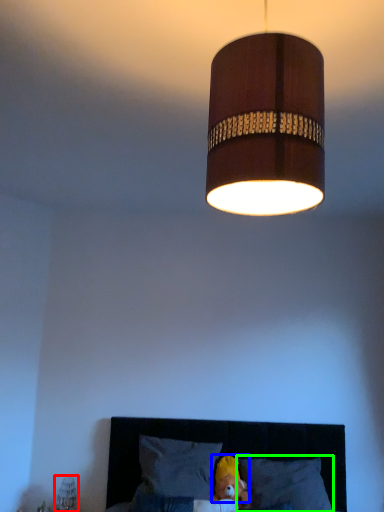
Question: Which object is positioned closest to bedside lamp (highlighted by a red box)? Select from head (highlighted by a blue box) and pillow (highlighted by a green box).

Choices:
 (A) head
 (B) pillow

Answer: (A)